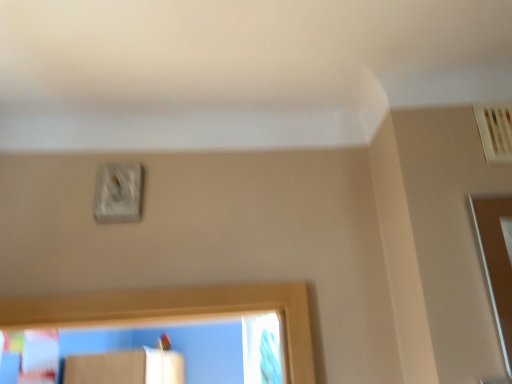
Question: Is white textured switch at upper center taller than clear glass screen door at right?

Choices:
 (A) yes
 (B) no

Answer: (B)

Question: Is white textured switch at upper center behind clear glass screen door at right?

Choices:
 (A) yes
 (B) no

Answer: (A)

Question: Considering the relative sizes of white textured switch at upper center and clear glass screen door at right in the image provided, is white textured switch at upper center bigger than clear glass screen door at right?

Choices:
 (A) no
 (B) yes

Answer: (A)

Question: Is white textured switch at upper center to the right of clear glass screen door at right from the viewer's perspective?

Choices:
 (A) yes
 (B) no

Answer: (B)

Question: Is white textured switch at upper center positioned with its back to clear glass screen door at right?

Choices:
 (A) no
 (B) yes

Answer: (A)

Question: Does white textured switch at upper center turn towards clear glass screen door at right?

Choices:
 (A) no
 (B) yes

Answer: (A)

Question: From a real-world perspective, is clear glass screen door at right on top of white textured switch at upper center?

Choices:
 (A) no
 (B) yes

Answer: (A)

Question: From a real-world perspective, does clear glass screen door at right sit lower than white textured switch at upper center?

Choices:
 (A) yes
 (B) no

Answer: (A)

Question: Is clear glass screen door at right oriented away from white textured switch at upper center?

Choices:
 (A) yes
 (B) no

Answer: (B)

Question: Does clear glass screen door at right appear on the right side of white textured switch at upper center?

Choices:
 (A) yes
 (B) no

Answer: (A)

Question: Considering the relative sizes of clear glass screen door at right and white textured switch at upper center in the image provided, is clear glass screen door at right taller than white textured switch at upper center?

Choices:
 (A) yes
 (B) no

Answer: (A)

Question: Is clear glass screen door at right not close to white textured switch at upper center?

Choices:
 (A) no
 (B) yes

Answer: (A)

Question: Looking at the image, does clear glass screen door at right seem bigger or smaller compared to white textured switch at upper center?

Choices:
 (A) small
 (B) big

Answer: (B)